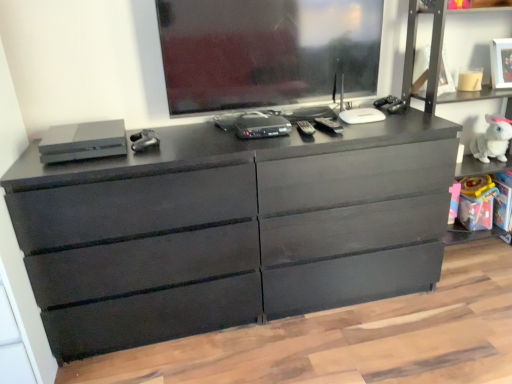
At what (x,y) coordinates should I click in order to perform the action: click on vacant space to the right of satin gray console at left, marked as the 3th equipment in a right-to-left arrangement. Please return your answer as a coordinate pair (x, y). Looking at the image, I should click on (163, 142).